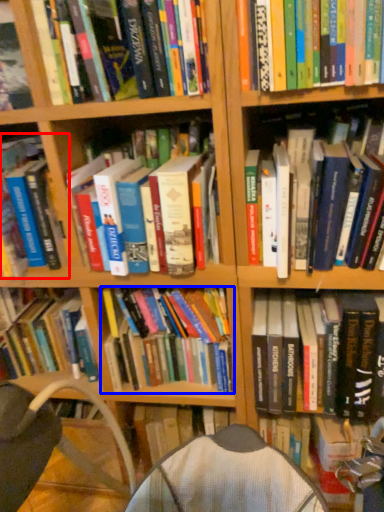
Question: Which object is closer to the camera taking this photo, book (highlighted by a red box) or book (highlighted by a blue box)?

Choices:
 (A) book
 (B) book

Answer: (A)